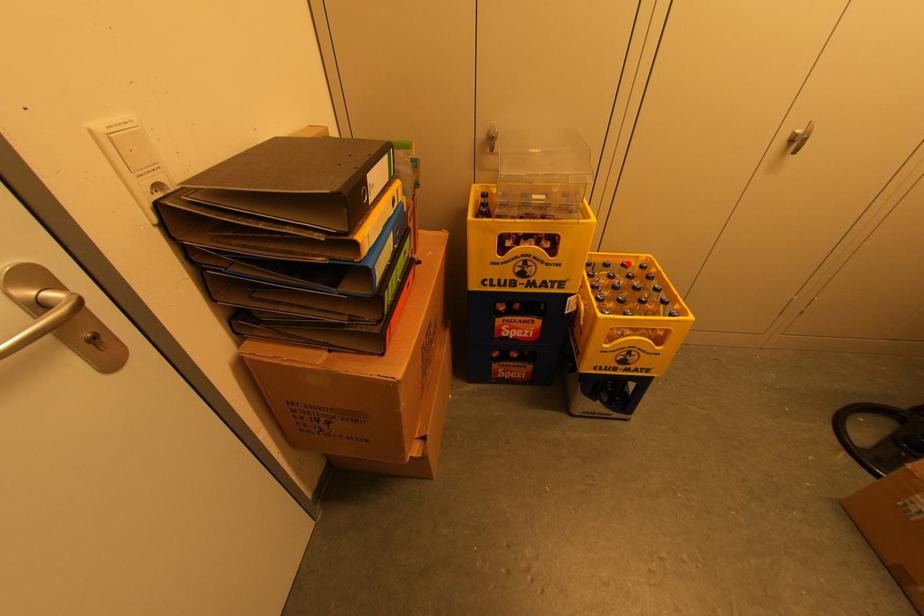
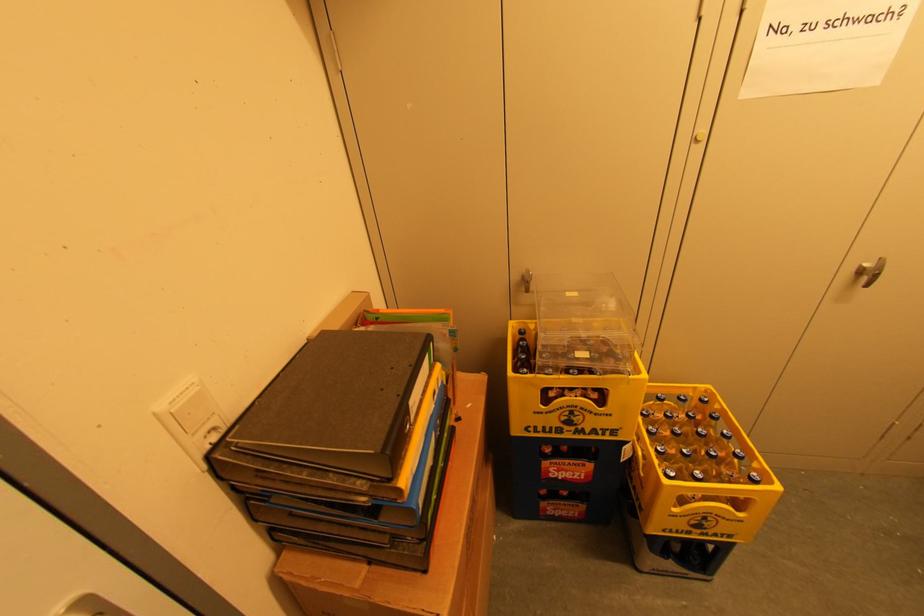
Question: I am providing you with two images of the same scene from different viewpoints. Image1 has a red point marked. In image2, the corresponding 3D location appears at what relative position? Reply with the corresponding letter.

Choices:
 (A) Closer
 (B) Farther

Answer: (B)